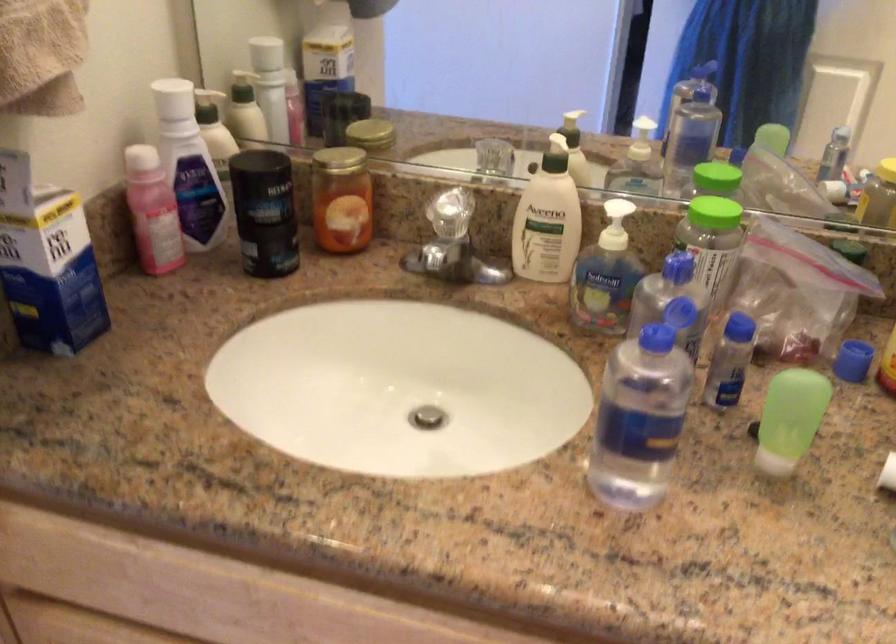
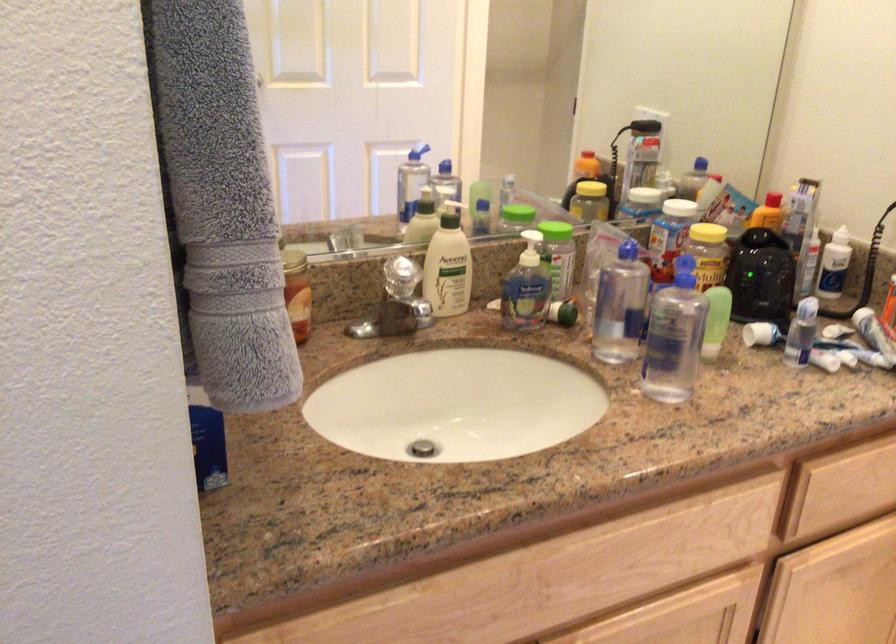
Question: I am providing you with two images of the same scene from different viewpoints. Please identify which objects are invisible in image2.

Choices:
 (A) green soap pump
 (B) crystal faucet handle
 (C) blue and white box
 (D) orange cylindrical object

Answer: (C)